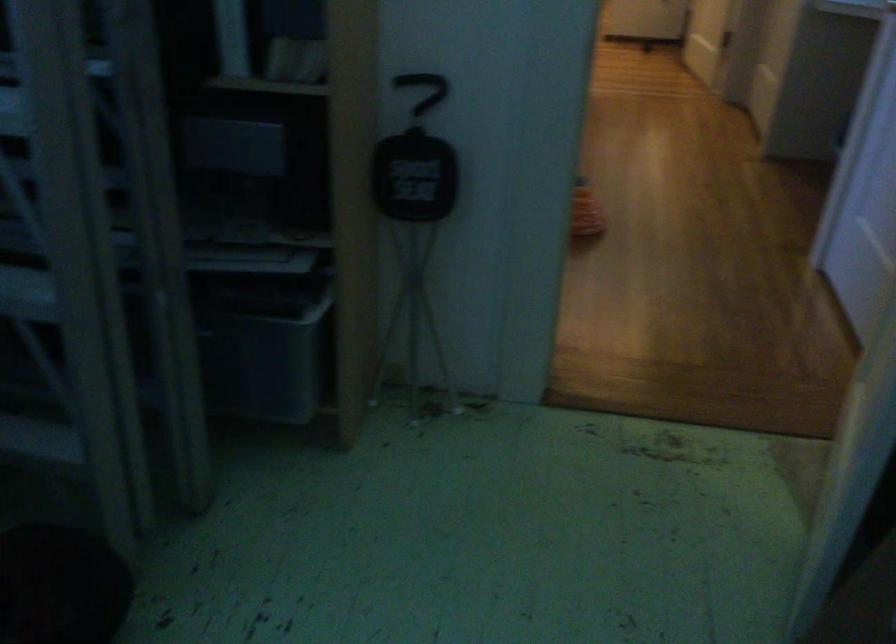
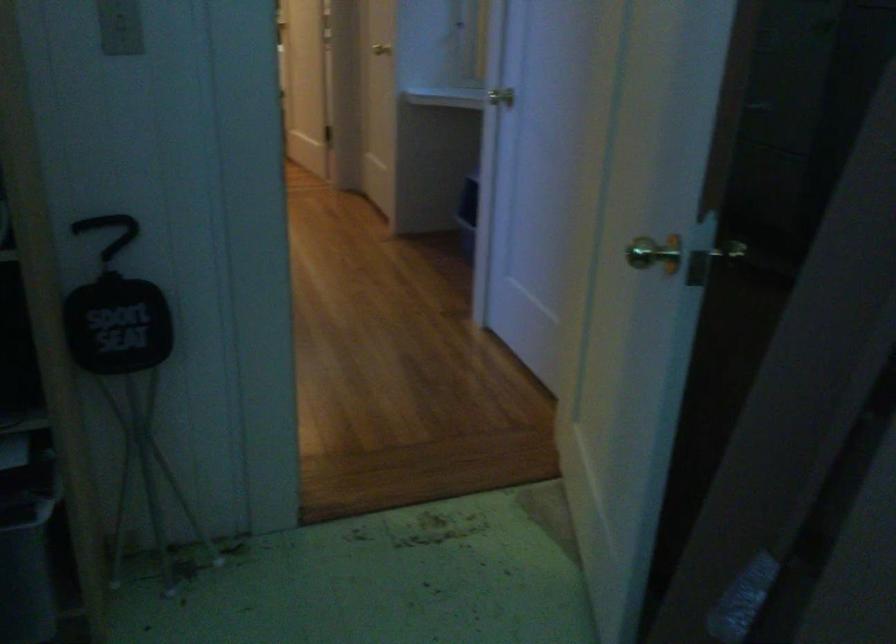
In the second image, find the point that corresponds to [411,175] in the first image.

(117, 325)